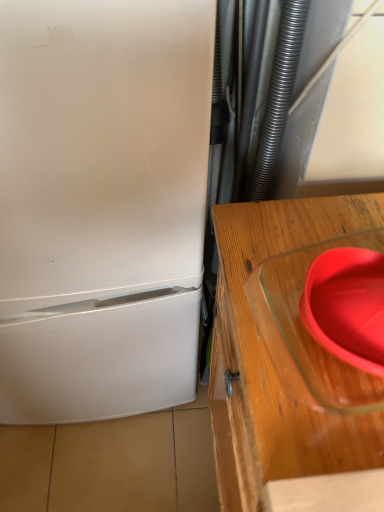
Question: From the image's perspective, is matte glass bowl at right on top of transparent glass table at right?

Choices:
 (A) yes
 (B) no

Answer: (A)

Question: Is matte glass bowl at right taller than transparent glass table at right?

Choices:
 (A) yes
 (B) no

Answer: (B)

Question: Considering the relative positions of matte glass bowl at right and transparent glass table at right in the image provided, is matte glass bowl at right to the right of transparent glass table at right from the viewer's perspective?

Choices:
 (A) no
 (B) yes

Answer: (A)

Question: Is matte glass bowl at right next to transparent glass table at right and touching it?

Choices:
 (A) no
 (B) yes

Answer: (B)

Question: Is matte glass bowl at right completely or partially outside of transparent glass table at right?

Choices:
 (A) yes
 (B) no

Answer: (A)

Question: Would you consider matte glass bowl at right to be distant from transparent glass table at right?

Choices:
 (A) no
 (B) yes

Answer: (A)

Question: Can you confirm if white matte refrigerator at left is bigger than matte glass bowl at right?

Choices:
 (A) yes
 (B) no

Answer: (A)

Question: From a real-world perspective, is white matte refrigerator at left located higher than matte glass bowl at right?

Choices:
 (A) no
 (B) yes

Answer: (A)

Question: Is white matte refrigerator at left facing away from matte glass bowl at right?

Choices:
 (A) yes
 (B) no

Answer: (B)

Question: Is white matte refrigerator at left beside matte glass bowl at right?

Choices:
 (A) yes
 (B) no

Answer: (B)

Question: Does white matte refrigerator at left contain matte glass bowl at right?

Choices:
 (A) yes
 (B) no

Answer: (B)

Question: Does white matte refrigerator at left have a greater width compared to matte glass bowl at right?

Choices:
 (A) no
 (B) yes

Answer: (B)

Question: Is white matte refrigerator at left at the back of matte glass bowl at right?

Choices:
 (A) no
 (B) yes

Answer: (A)